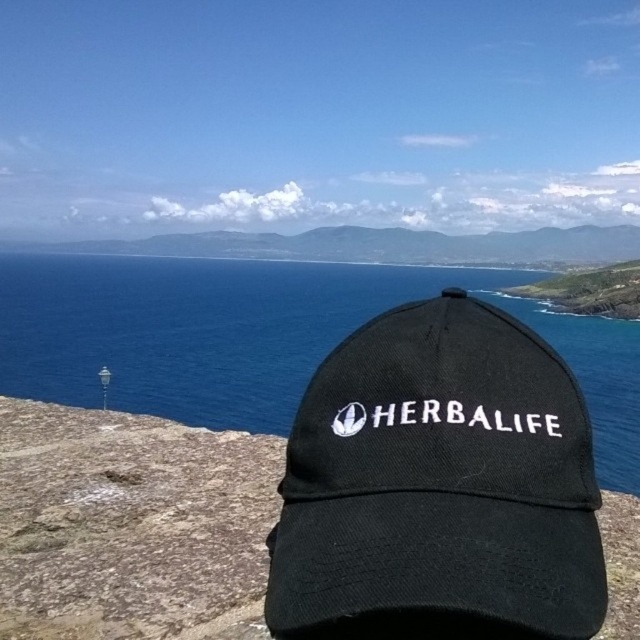
From the picture: You are a photographer standing in front of the black fabric cap at center and the blue water at center. Which object is closer to you?

The black fabric cap at center is closer to you because the blue water at center is further away.

You are a photographer trying to capture the black fabric baseball cap at center and the black fabric cap at center in a single shot. Which one is positioned higher in the frame?

The black fabric baseball cap at center is located above the black fabric cap at center, so it is positioned higher in the frame.